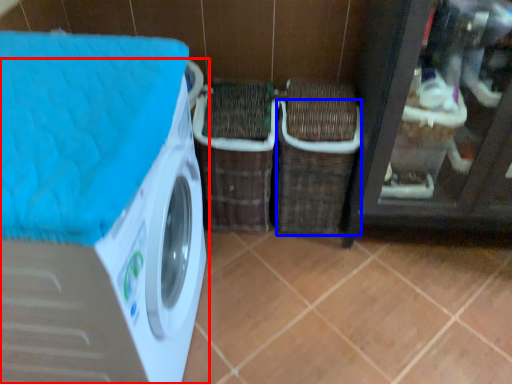
Question: Which of the following is the farthest to the observer, washing machine (highlighted by a red box) or basket (highlighted by a blue box)?

Choices:
 (A) washing machine
 (B) basket

Answer: (B)